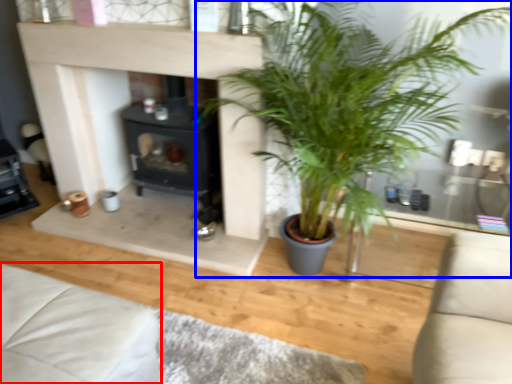
Question: Among these objects, which one is farthest to the camera, couch (highlighted by a red box) or houseplant (highlighted by a blue box)?

Choices:
 (A) couch
 (B) houseplant

Answer: (A)